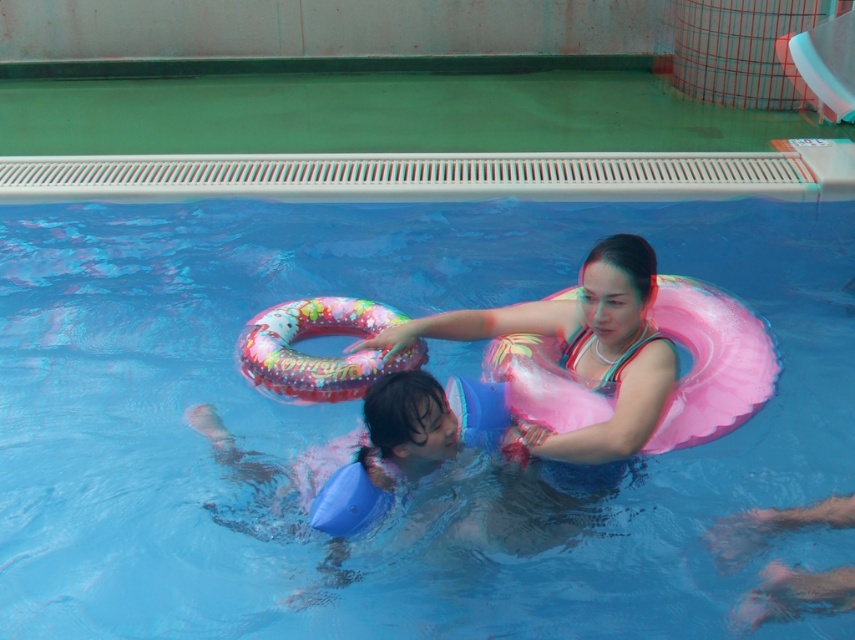
Question: Which point appears closest to the camera in this image?

Choices:
 (A) (575, 372)
 (B) (213, 541)

Answer: (A)

Question: Can you confirm if blue rubber ring at center is wider than matte pink float at center?

Choices:
 (A) no
 (B) yes

Answer: (B)

Question: Can you confirm if blue rubber ring at center is wider than matte pink float at center?

Choices:
 (A) no
 (B) yes

Answer: (B)

Question: Among these objects, which one is farthest from the camera?

Choices:
 (A) matte pink float at center
 (B) blue rubber ring at center

Answer: (B)

Question: Observing the image, what is the correct spatial positioning of blue rubber ring at center in reference to matte pink float at center?

Choices:
 (A) left
 (B) right

Answer: (B)